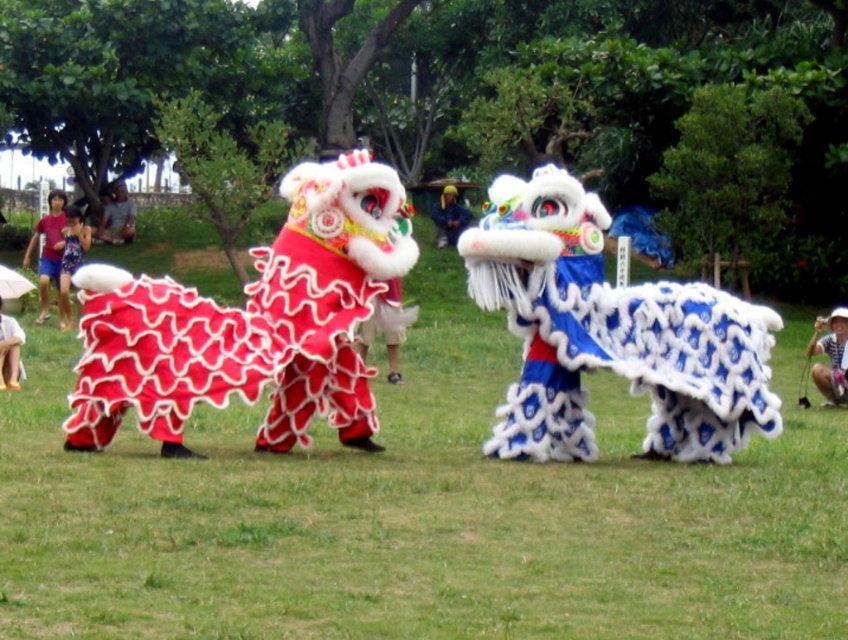
Question: From the image, what is the correct spatial relationship of striped shirt at center in relation to yellow fabric person at center?

Choices:
 (A) right
 (B) left

Answer: (A)

Question: Considering the real-world distances, which object is farthest from the blue denim shorts at left?

Choices:
 (A) striped shirt at center
 (B) matte pink shorts at left

Answer: (A)

Question: Does matte pink shorts at left have a smaller size compared to striped shirt at center?

Choices:
 (A) yes
 (B) no

Answer: (B)

Question: Is blue fuzzy lion at center closer to the viewer compared to blue denim shorts at lower left?

Choices:
 (A) no
 (B) yes

Answer: (B)

Question: Which point appears farthest from the camera in this image?

Choices:
 (A) (17, 326)
 (B) (183, 369)
 (C) (65, 305)

Answer: (C)

Question: Among these points, which one is farthest from the camera?

Choices:
 (A) (548, 248)
 (B) (9, 385)
 (C) (824, 352)
 (D) (450, 218)

Answer: (D)